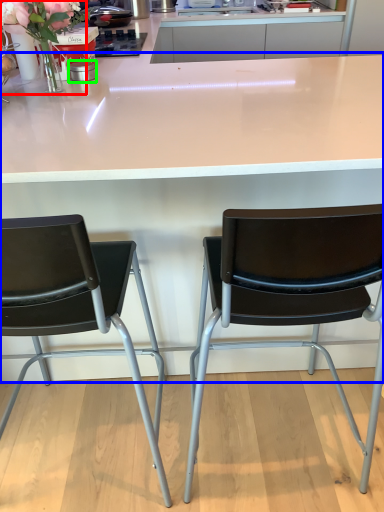
Question: Based on their relative distances, which object is nearer to floral arrangement (highlighted by a red box)? Choose from table (highlighted by a blue box) and appliance (highlighted by a green box).

Choices:
 (A) table
 (B) appliance

Answer: (B)